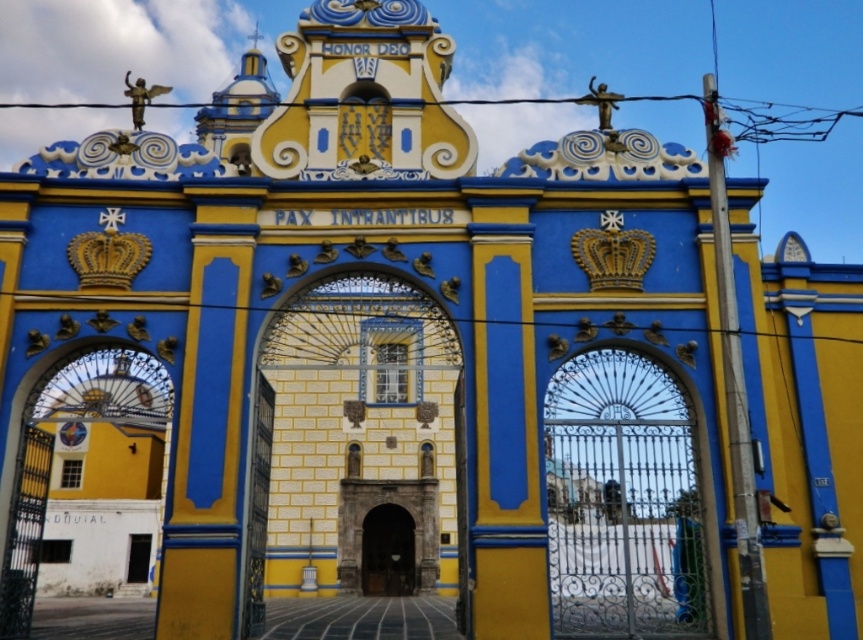
Question: Among these objects, which one is farthest from the camera?

Choices:
 (A) dark wood door at center
 (B) smooth wood door at center

Answer: (A)

Question: Is smooth wood door at center closer to camera compared to dark wood door at center?

Choices:
 (A) no
 (B) yes

Answer: (B)

Question: In this image, where is smooth wood door at center located relative to dark wood door at center?

Choices:
 (A) left
 (B) right

Answer: (A)

Question: Does smooth wood door at center have a lesser width compared to dark wood door at center?

Choices:
 (A) no
 (B) yes

Answer: (B)

Question: Among these objects, which one is farthest from the camera?

Choices:
 (A) dark wood door at center
 (B) smooth wood door at center

Answer: (A)

Question: Which object appears closest to the camera in this image?

Choices:
 (A) smooth wood door at center
 (B) dark wood door at center

Answer: (A)